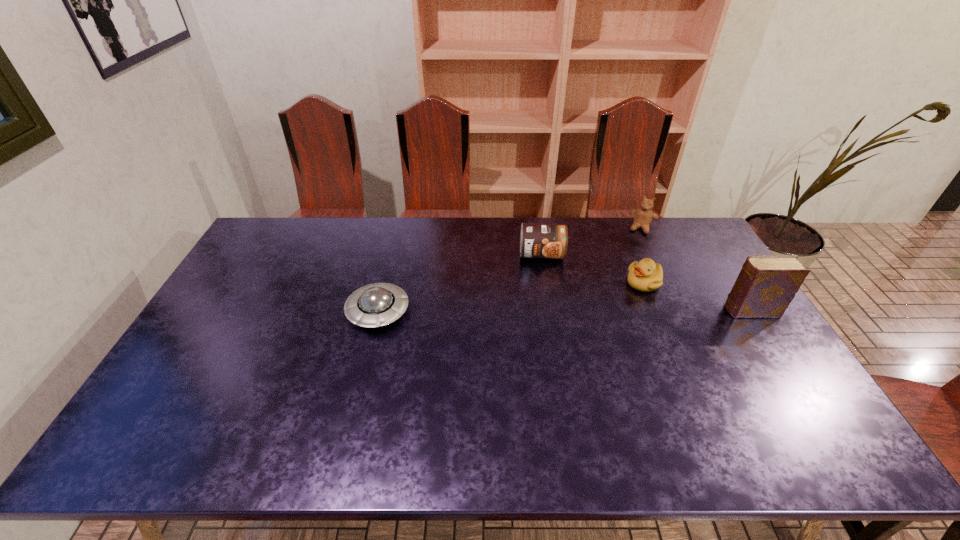
You are a GUI agent. You are given a task and a screenshot of the screen. Output one action in this format:
    pyautogui.click(x=<x>, y=<y>)
    Task: Click on the free space between the fourth object from right to left and the teddy bear
    This screenshot has height=540, width=960.
    Given the screenshot: What is the action you would take?
    pyautogui.click(x=591, y=241)

At what (x,y) coordinates should I click in order to perform the action: click on empty location between the duckling and the teddy bear. Please return your answer as a coordinate pair (x, y). Looking at the image, I should click on (643, 255).

Find the location of a particular element. This screenshot has height=540, width=960. object that ranks as the fourth closest to the fourth object from right to left is located at coordinates (766, 285).

Point out which object is positioned as the fourth nearest to the can. Please provide its 2D coordinates. Your answer should be formatted as a tuple, i.e. [(x, y)], where the tuple contains the x and y coordinates of a point satisfying the conditions above.

[(766, 285)]

This screenshot has height=540, width=960. I want to click on free spot that satisfies the following two spatial constraints: 1. on the back side of the can; 2. on the left side of the farthest object, so click(537, 228).

At what (x,y) coordinates should I click in order to perform the action: click on vacant area that satisfies the following two spatial constraints: 1. on the back side of the duckling; 2. on the right side of the saucer. Please return your answer as a coordinate pair (x, y). Looking at the image, I should click on (385, 283).

The width and height of the screenshot is (960, 540). I want to click on vacant space that satisfies the following two spatial constraints: 1. on the back side of the saucer; 2. on the left side of the teddy bear, so click(398, 228).

The image size is (960, 540). What are the coordinates of `free space that satisfies the following two spatial constraints: 1. on the front side of the rightmost object; 2. on the spine side of the can` in the screenshot? It's located at (551, 310).